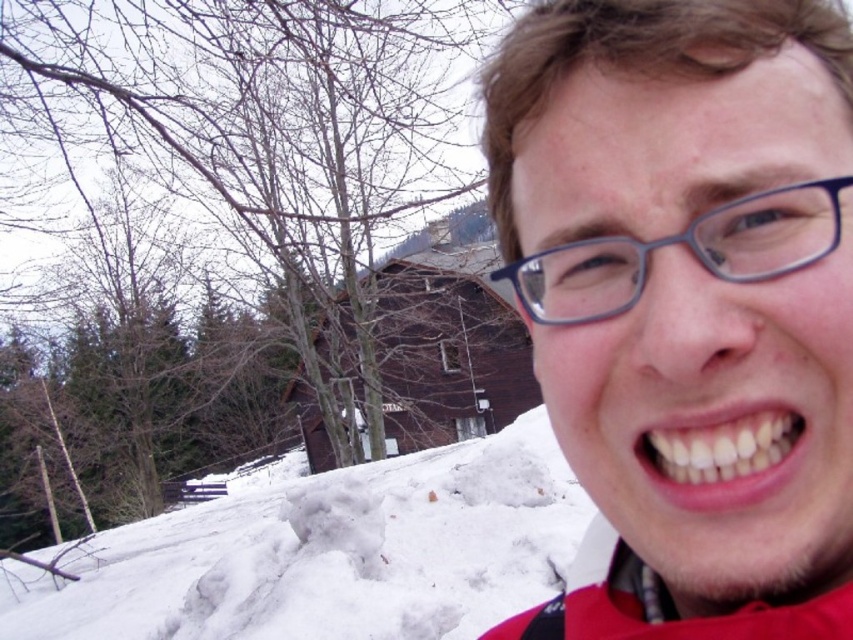
Looking at this image, between white fluffy snow at lower left and blue plastic glasses at upper right, which one has less height?

blue plastic glasses at upper right

Describe the element at coordinates (329, 552) in the screenshot. I see `white fluffy snow at lower left` at that location.

Find the location of a particular element. This screenshot has height=640, width=853. white fluffy snow at lower left is located at coordinates (329, 552).

How distant is matte blue glasses at center from blue plastic glasses at upper right?

They are 11.27 centimeters apart.

Does point (532, 26) come in front of point (838, 186)?

No, (532, 26) is further to viewer.

Describe the element at coordinates (686, 304) in the screenshot. I see `matte blue glasses at center` at that location.

The height and width of the screenshot is (640, 853). Identify the location of matte blue glasses at center. (686, 304).

Can you confirm if matte blue glasses at center is thinner than white fluffy snow at lower left?

Yes, matte blue glasses at center is thinner than white fluffy snow at lower left.

Which of these two, matte blue glasses at center or white fluffy snow at lower left, stands shorter?

matte blue glasses at center is shorter.

Who is more forward, (527, 106) or (583, 516)?

Point (527, 106)

Identify the location of matte blue glasses at center. This screenshot has height=640, width=853. (686, 304).